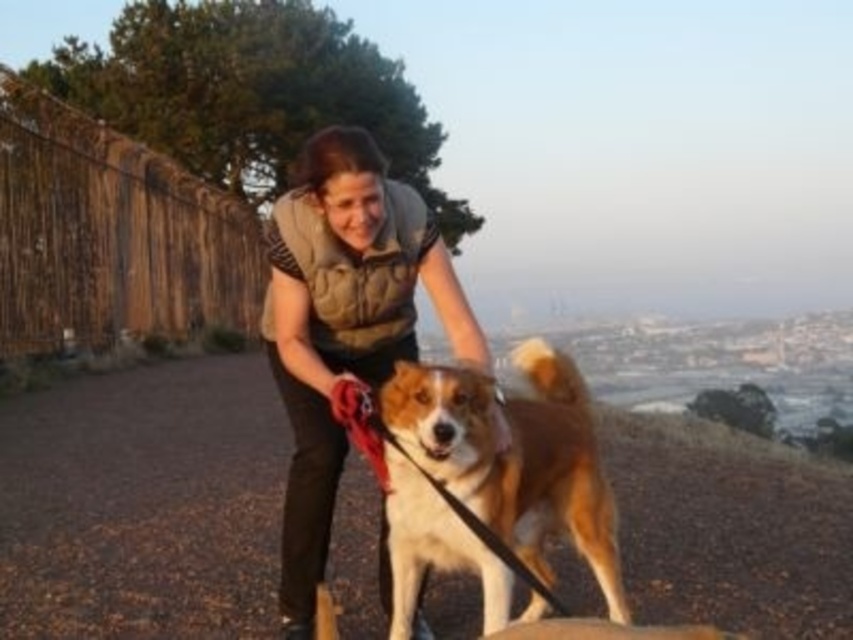
Question: Does brown fur dog at center appear on the right side of brown and white fur at center?

Choices:
 (A) no
 (B) yes

Answer: (A)

Question: Which point is farther to the camera?

Choices:
 (A) brown and white fur at center
 (B) brown fur dog at center

Answer: (B)

Question: Can you confirm if brown fur dog at center is smaller than matte brown vest at center?

Choices:
 (A) yes
 (B) no

Answer: (B)

Question: Is brown fur dog at center positioned behind brown and white fur at center?

Choices:
 (A) yes
 (B) no

Answer: (A)

Question: Estimate the real-world distances between objects in this image. Which object is farther from the brown fur dog at center?

Choices:
 (A) brown and white fur at center
 (B) matte brown vest at center

Answer: (A)

Question: Which object is closer to the camera taking this photo?

Choices:
 (A) matte brown vest at center
 (B) brown fur dog at center

Answer: (A)